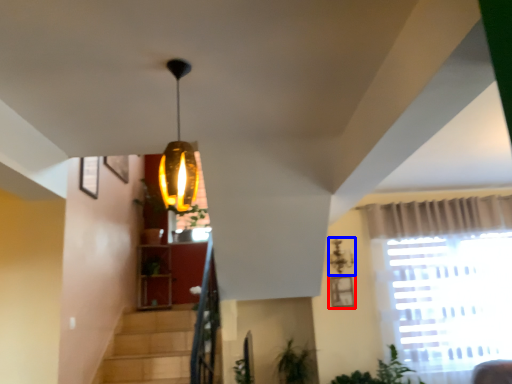
Question: Among these objects, which one is nearest to the camera, picture frame (highlighted by a red box) or lamp (highlighted by a blue box)?

Choices:
 (A) picture frame
 (B) lamp

Answer: (B)